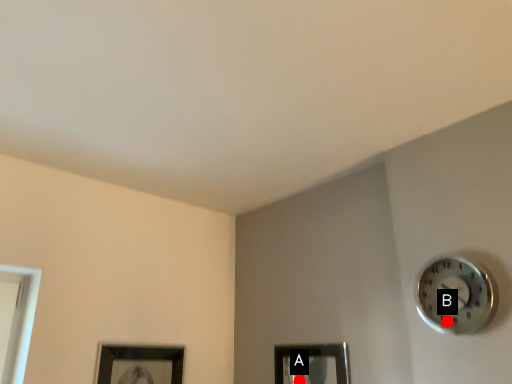
Question: Two points are circled on the image, labeled by A and B beside each circle. Which point is closer to the camera taking this photo?

Choices:
 (A) A is closer
 (B) B is closer

Answer: (B)